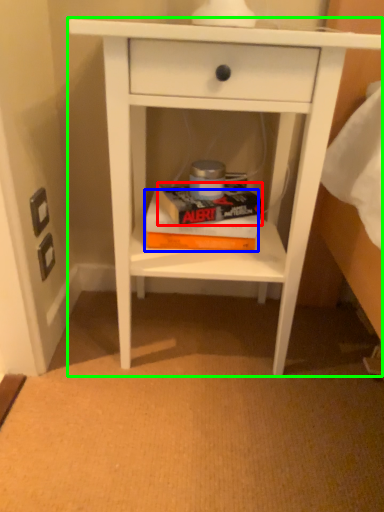
Question: Estimate the real-world distances between objects in this image. Which object is closer to paperback book (highlighted by a red box), paperback book (highlighted by a blue box) or nightstand (highlighted by a green box)?

Choices:
 (A) paperback book
 (B) nightstand

Answer: (A)